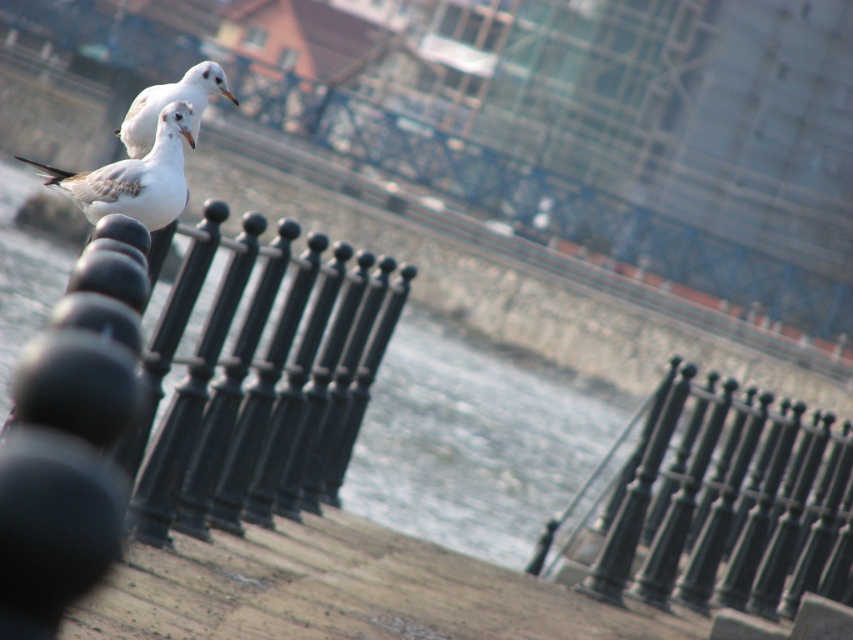
Between point (177, 138) and point (194, 93), which one is positioned behind?

Positioned behind is point (194, 93).

Does point (180, 196) come behind point (137, 131)?

No, it is not.

Where is `white feathered seagull at center`? The image size is (853, 640). white feathered seagull at center is located at coordinates (135, 177).

Which is more to the left, black metal fence at upper left or white feathered seagull at center?

white feathered seagull at center is more to the left.

You are a GUI agent. You are given a task and a screenshot of the screen. Output one action in this format:
    pyautogui.click(x=<x>, y=<y>)
    Task: Click on the black metal fence at upper left
    The image size is (853, 640).
    Given the screenshot: What is the action you would take?
    pyautogui.click(x=340, y=592)

Who is taller, black metal fence at upper left or white matte seagull at upper center?

Standing taller between the two is black metal fence at upper left.

Is black metal fence at upper left to the left of white matte seagull at upper center from the viewer's perspective?

Yes, black metal fence at upper left is to the left of white matte seagull at upper center.

What are the coordinates of `black metal fence at upper left` in the screenshot? It's located at (340, 592).